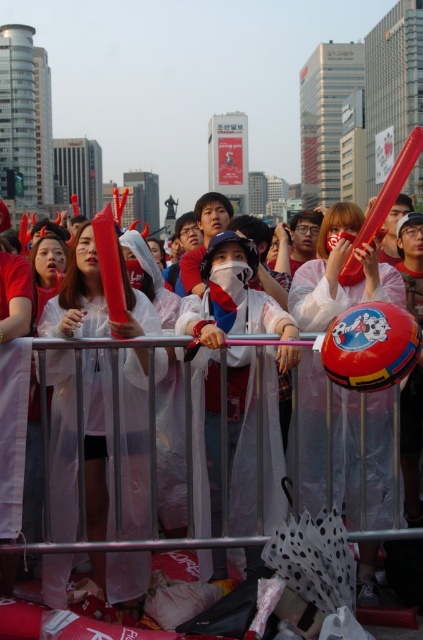
Question: Can you confirm if white plastic raincoat at center is thinner than matte red horn at center?

Choices:
 (A) yes
 (B) no

Answer: (A)

Question: Which object is farther from the camera taking this photo?

Choices:
 (A) red glossy helmet at center
 (B) matte red plastic tube at center
 (C) white plastic raincoat at center

Answer: (C)

Question: Among these points, which one is farthest from the camera?

Choices:
 (A) (69, 282)
 (B) (227, 326)
 (C) (63, 449)
 (D) (338, 241)

Answer: (D)

Question: Can you confirm if white plastic raincoat at center is smaller than matte red horn at center?

Choices:
 (A) yes
 (B) no

Answer: (A)

Question: Is white plastic raincoat at center further to the viewer compared to matte red horn at center?

Choices:
 (A) yes
 (B) no

Answer: (A)

Question: Which object is positioned farthest from the red glossy helmet at center?

Choices:
 (A) matte red plastic tube at center
 (B) white plastic raincoat at center

Answer: (A)